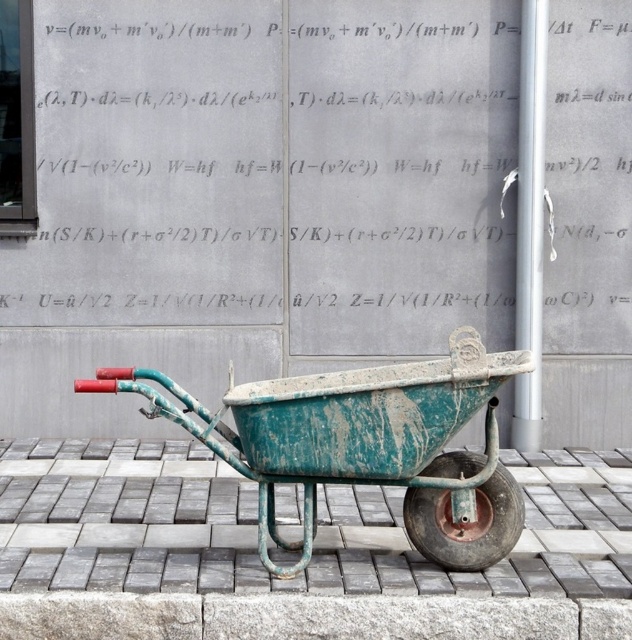
Between green weathered wheelbarrow at center and rusty metal wheel at lower center, which one has less height?

With less height is rusty metal wheel at lower center.

Does point (441, 358) lie in front of point (521, 492)?

That is False.

This screenshot has width=632, height=640. I want to click on green weathered wheelbarrow at center, so click(367, 444).

Who is shorter, green weathered pavement at center or green weathered wheelbarrow at center?

green weathered pavement at center is shorter.

Consider the image. Does green weathered pavement at center appear under green weathered wheelbarrow at center?

Yes, green weathered pavement at center is below green weathered wheelbarrow at center.

Measure the distance between point (95, 536) and camera.

Point (95, 536) is 5.72 meters from camera.

You are a GUI agent. You are given a task and a screenshot of the screen. Output one action in this format:
    pyautogui.click(x=<x>, y=<y>)
    Task: Click on the green weathered pavement at center
    
    Given the screenshot: What is the action you would take?
    pyautogui.click(x=308, y=564)

Is point (56, 612) farther from viewer compared to point (46, 636)?

No, (56, 612) is in front of (46, 636).

Can you confirm if green weathered pavement at center is bigger than gray stone curb at lower center?

Correct, green weathered pavement at center is larger in size than gray stone curb at lower center.

Identify the location of green weathered pavement at center. (308, 564).